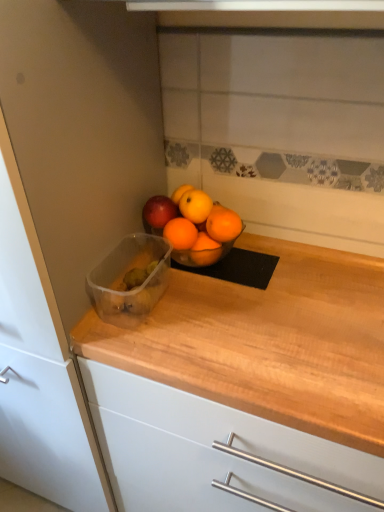
Question: From a real-world perspective, is wooden countertop at left below transparent plastic container at center?

Choices:
 (A) no
 (B) yes

Answer: (B)

Question: From the image's perspective, is wooden countertop at left below transparent plastic container at center?

Choices:
 (A) yes
 (B) no

Answer: (A)

Question: Is the depth of wooden countertop at left greater than that of transparent plastic container at center?

Choices:
 (A) no
 (B) yes

Answer: (A)

Question: Considering the relative sizes of wooden countertop at left and transparent plastic container at center in the image provided, is wooden countertop at left taller than transparent plastic container at center?

Choices:
 (A) yes
 (B) no

Answer: (A)

Question: Can you confirm if wooden countertop at left is positioned to the right of transparent plastic container at center?

Choices:
 (A) no
 (B) yes

Answer: (A)

Question: Is point (168, 443) positioned closer to the camera than point (11, 423)?

Choices:
 (A) farther
 (B) closer

Answer: (B)

Question: Considering the positions of wooden at center and wooden countertop at left in the image, is wooden at center taller or shorter than wooden countertop at left?

Choices:
 (A) short
 (B) tall

Answer: (A)

Question: Based on their sizes in the image, would you say wooden at center is bigger or smaller than wooden countertop at left?

Choices:
 (A) big
 (B) small

Answer: (B)

Question: Looking at their shapes, would you say wooden at center is wider or thinner than wooden countertop at left?

Choices:
 (A) thin
 (B) wide

Answer: (A)

Question: Relative to wooden countertop at left, is transparent plastic container at center in front or behind?

Choices:
 (A) behind
 (B) front

Answer: (A)

Question: Is transparent plastic container at center bigger or smaller than wooden countertop at left?

Choices:
 (A) big
 (B) small

Answer: (B)

Question: Is transparent plastic container at center spatially inside wooden countertop at left, or outside of it?

Choices:
 (A) outside
 (B) inside

Answer: (A)

Question: From the image's perspective, is transparent plastic container at center above or below wooden countertop at left?

Choices:
 (A) below
 (B) above

Answer: (B)

Question: In terms of width, does wooden countertop at left look wider or thinner when compared to wooden at center?

Choices:
 (A) thin
 (B) wide

Answer: (B)

Question: In the image, is wooden countertop at left positioned in front of or behind wooden at center?

Choices:
 (A) behind
 (B) front

Answer: (B)